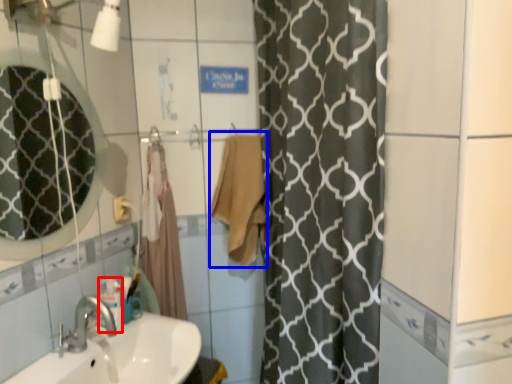
Question: Which point is further to the camera, toiletry (highlighted by a red box) or bath towel (highlighted by a blue box)?

Choices:
 (A) toiletry
 (B) bath towel

Answer: (B)